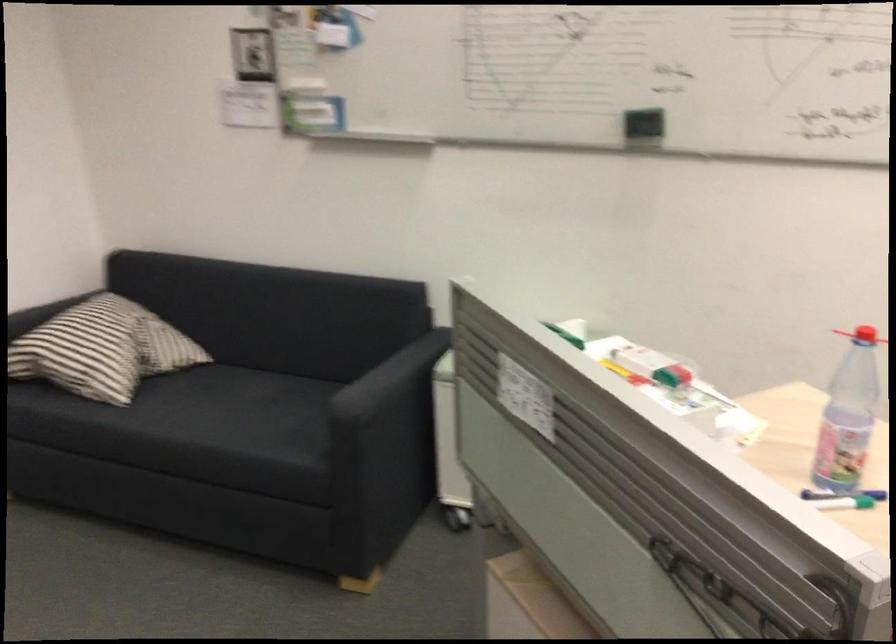
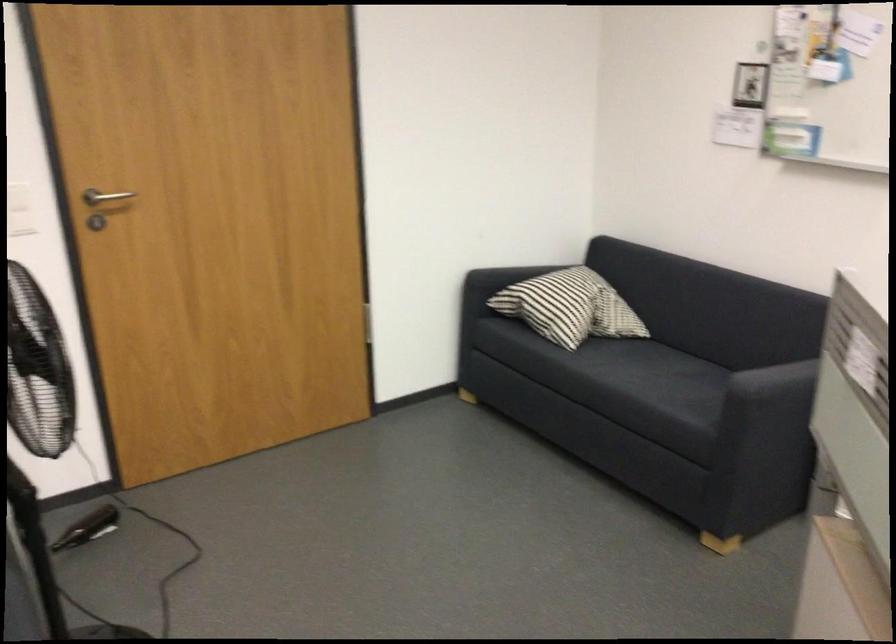
Question: The camera is either moving clockwise (left) or counter-clockwise (right) around the object. The first image is from the beginning of the video and the second image is from the end. Is the camera moving left or right when shooting the video?

Choices:
 (A) Left
 (B) Right

Answer: (B)